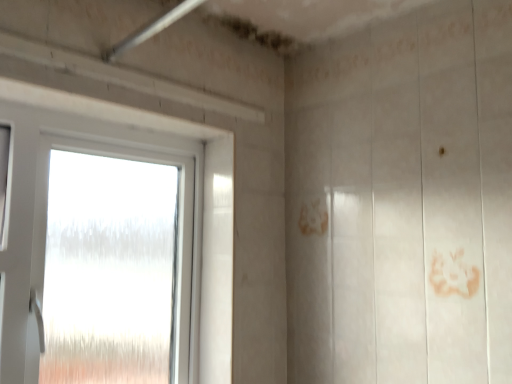
Question: Should I look upward or downward to see white plastic window at left?

Choices:
 (A) down
 (B) up

Answer: (A)